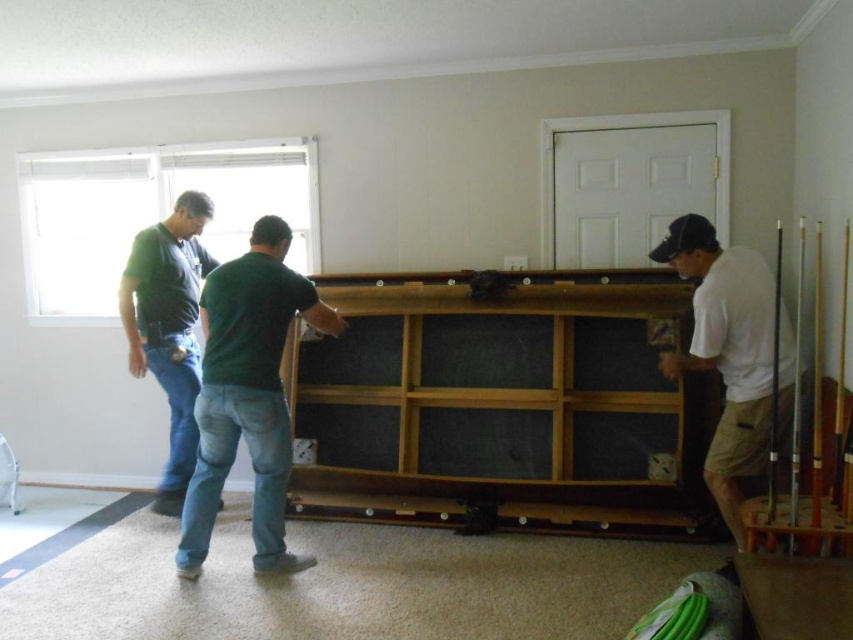
You are a delivery person who needs to fit a new rectangular box into the space where the green matte shirt at center and the matte black shirt at left are standing. The box requires a space that is as large as the combined area of both individuals. Can the box fit in the available space?

The green matte shirt at center occupies less space than the matte black shirt at left, so the combined area of both individuals would be larger than the space required for the box. Therefore, the box can fit in the available space.

You are a delivery person who just arrived at the house and need to enter the room through the door. The two people in the room are wearing the green matte shirt at center and the matte black shirt at left. Which person should you ask for help if you want to reach the door on the right side of the room?

The green matte shirt at center is shorter than the matte black shirt at left, so the matte black shirt at left is taller. Since the door is on the right side of the room, the person wearing the matte black shirt at left might have a better view and can guide you to the door.

You are a delivery person trying to enter the room through the door on the right. The two people inside are wearing the white cotton shirt at right and the matte black shirt at left. If you need to hand a package to the person closer to the door, which one should you give it to?

The white cotton shirt at right is closer to the door than the matte black shirt at left, so you should give the package to the white cotton shirt at right.